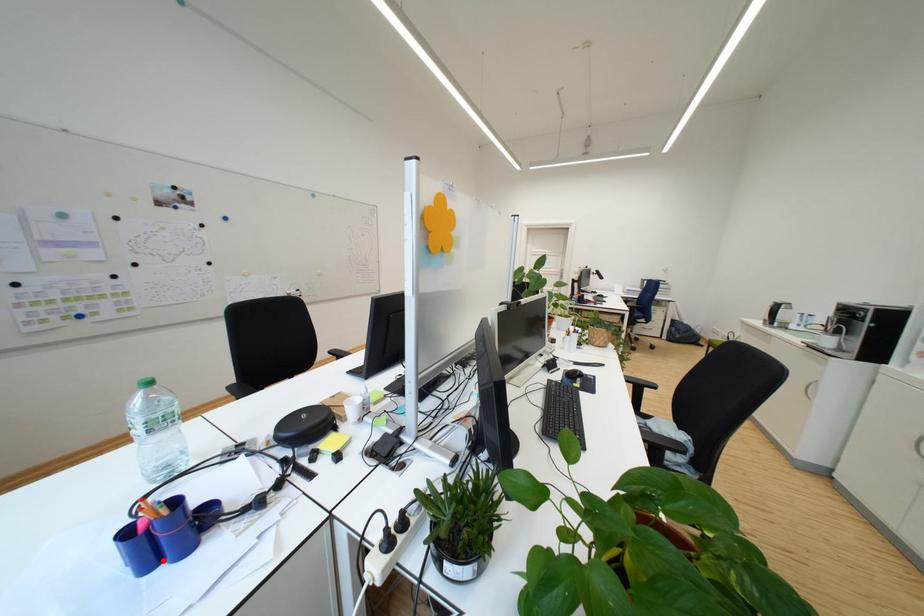
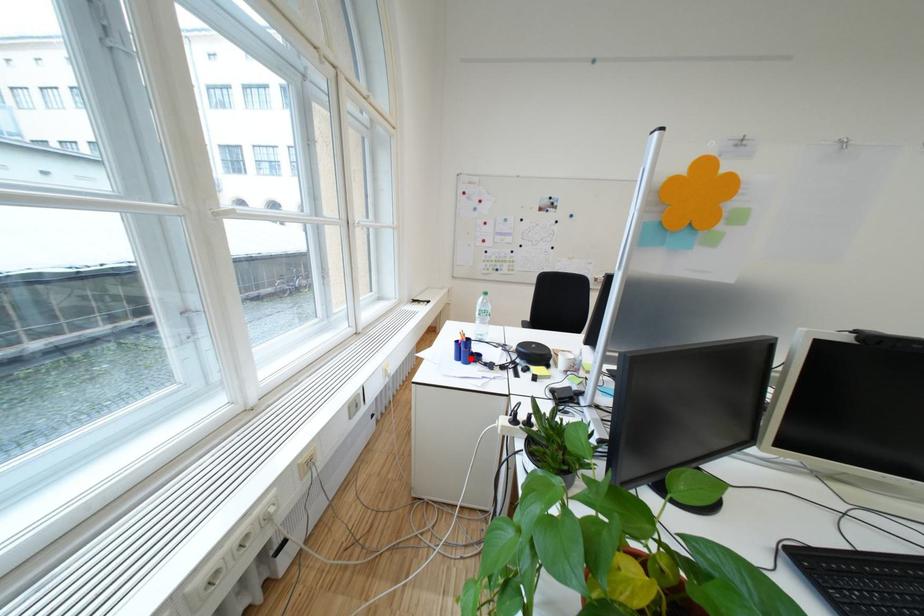
I am providing you with two images of the same scene from different viewpoints. A red point is marked on the first image and another point is marked on the second image. Does the point marked in image1 correspond to the same location as the one in image2?

Yes